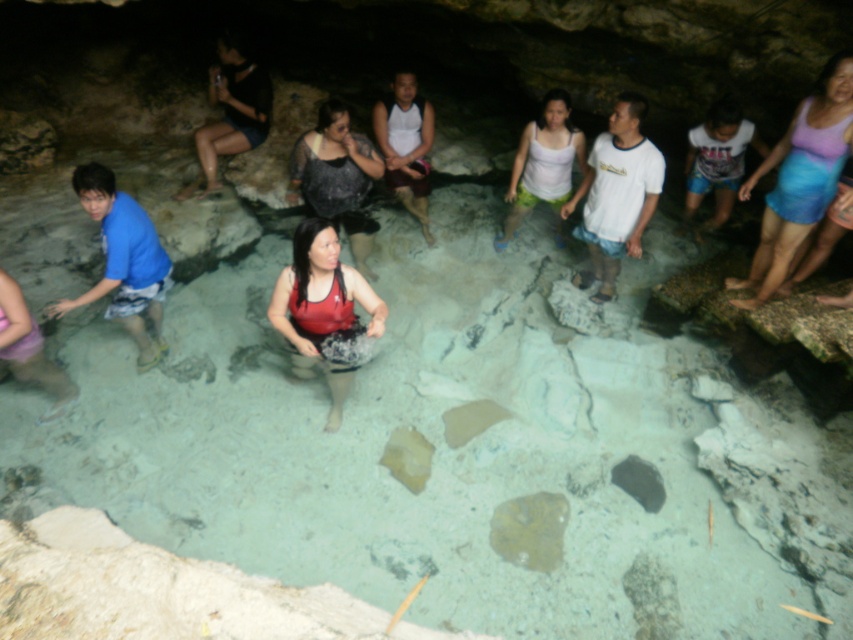
Between matte black dress at center and white cotton tank top at center, which one appears on the right side from the viewer's perspective?

white cotton tank top at center

Does point (360, 230) lie in front of point (553, 156)?

No, (360, 230) is further to viewer.

Locate an element on the screen. The width and height of the screenshot is (853, 640). matte black dress at center is located at coordinates (337, 177).

Who is positioned more to the left, matte red tank top at center or white cotton tank top at center?

matte red tank top at center is more to the left.

This screenshot has width=853, height=640. In order to click on matte red tank top at center in this screenshot , I will do `click(323, 310)`.

Does matte red tank top at center appear under matte black dress at center?

Indeed, matte red tank top at center is positioned under matte black dress at center.

Measure the distance between matte red tank top at center and camera.

matte red tank top at center is 3.75 meters from camera.

Measure the distance between point (332, 362) and camera.

Point (332, 362) and camera are 4.29 meters apart.

Find the location of `matte red tank top at center`. matte red tank top at center is located at coordinates (323, 310).